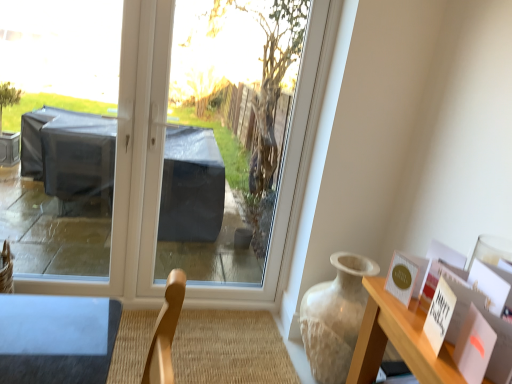
Question: From the image's perspective, is matte beige vase at right above or below transparent plastic at center?

Choices:
 (A) below
 (B) above

Answer: (A)

Question: Is matte beige vase at right spatially inside transparent plastic at center, or outside of it?

Choices:
 (A) inside
 (B) outside

Answer: (B)

Question: Which is farther from the matte gold postcard at upper right?

Choices:
 (A) matte beige vase at right
 (B) transparent plastic at center
 (C) transparent plastic window screen at center

Answer: (C)

Question: Estimate the real-world distances between objects in this image. Which object is closer to the matte beige vase at right?

Choices:
 (A) transparent plastic window screen at center
 (B) transparent plastic at center
 (C) matte gold postcard at upper right

Answer: (C)